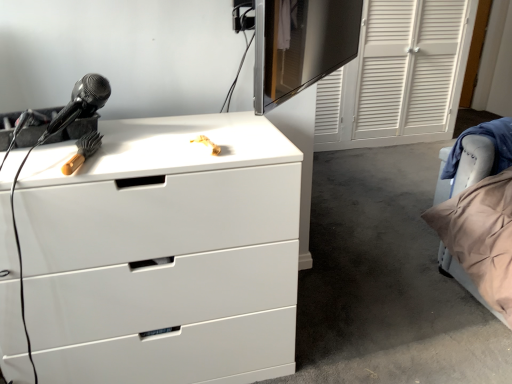
I want to click on free space that is to the left of velvet beige pillow at right, so click(x=402, y=266).